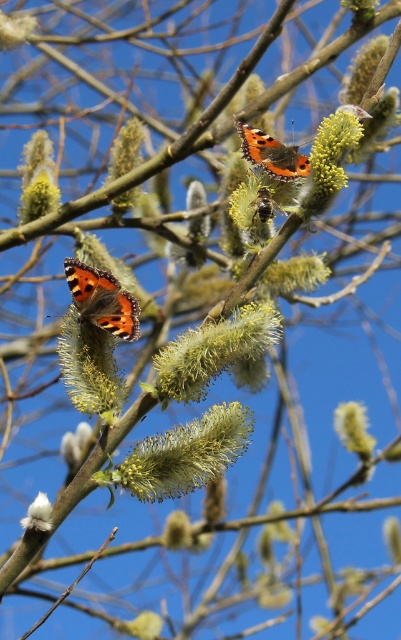
Question: Does yellow fuzzy flower at center have a greater width compared to soft yellow fluff at upper left?

Choices:
 (A) no
 (B) yes

Answer: (B)

Question: Which point is closer to the camera?

Choices:
 (A) (115, 385)
 (B) (28, 29)
 (C) (34, 525)

Answer: (C)

Question: Does fuzzy yellow flower at center appear over fluffy white flower at center?

Choices:
 (A) yes
 (B) no

Answer: (A)

Question: Based on their relative distances, which object is nearer to the fuzzy yellow flower at left?

Choices:
 (A) fluffy white flower at center
 (B) yellow fuzzy catkin at center

Answer: (B)

Question: Is yellow fluffy catkin at upper left thinner than soft yellow fluff at upper left?

Choices:
 (A) yes
 (B) no

Answer: (B)

Question: Which of the following is the closest to the observer?

Choices:
 (A) fuzzy yellow flower at left
 (B) yellow fluffy catkin at upper left
 (C) fluffy yellow catkin at upper center

Answer: (C)